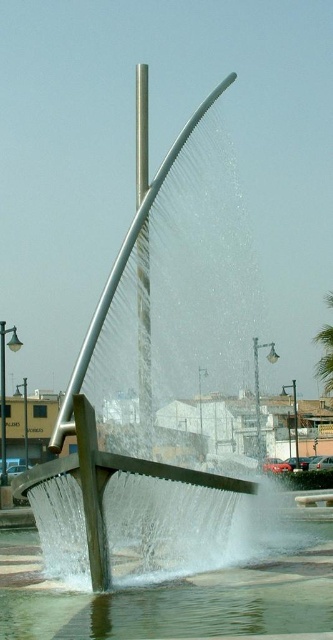
Is point (321, 625) positioned after point (322, 339)?

No, it is in front of (322, 339).

Does clear water at base center appear over green leafy palm tree at upper right?

No.

Which is behind, point (277, 582) or point (314, 339)?

Positioned behind is point (314, 339).

Where is `clear water at base center`? This screenshot has height=640, width=333. clear water at base center is located at coordinates (174, 596).